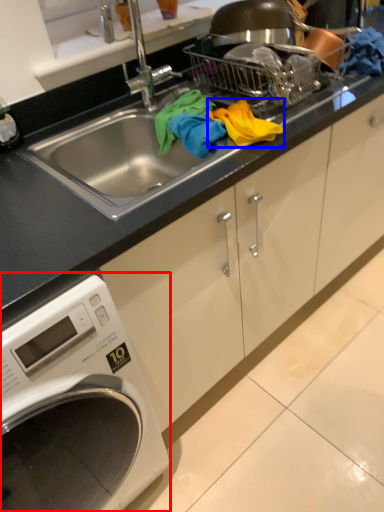
Question: Which object is further to the camera taking this photo, washing machine (highlighted by a red box) or material (highlighted by a blue box)?

Choices:
 (A) washing machine
 (B) material

Answer: (B)